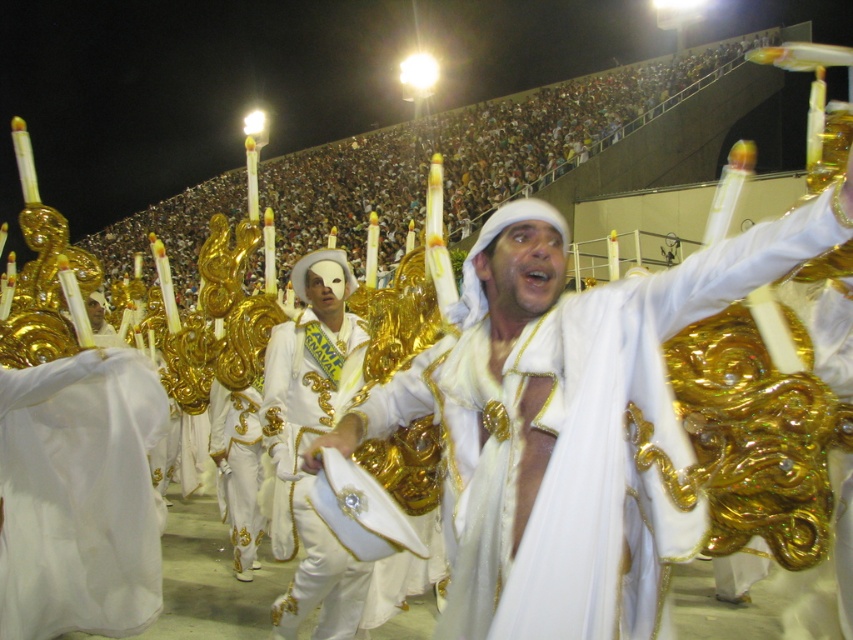
Does point (469, 413) come farther from viewer compared to point (113, 570)?

No, it is in front of (113, 570).

Consider the image. Who is more forward, (448, 353) or (51, 387)?

Point (448, 353) is in front.

Which is in front, point (730, 241) or point (143, 376)?

Positioned in front is point (730, 241).

At what (x,y) coordinates should I click in order to perform the action: click on white satin robe at center. Please return your answer as a coordinate pair (x, y). This screenshot has width=853, height=640. Looking at the image, I should click on (630, 435).